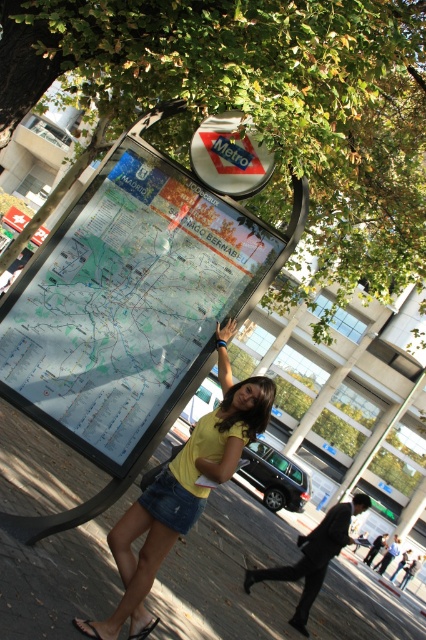
You are a tourist in Madrid and see the yellow matte shirt at center and the white glossy sign at upper center. Which object is taller?

The yellow matte shirt at center is much taller than the white glossy sign at upper center.